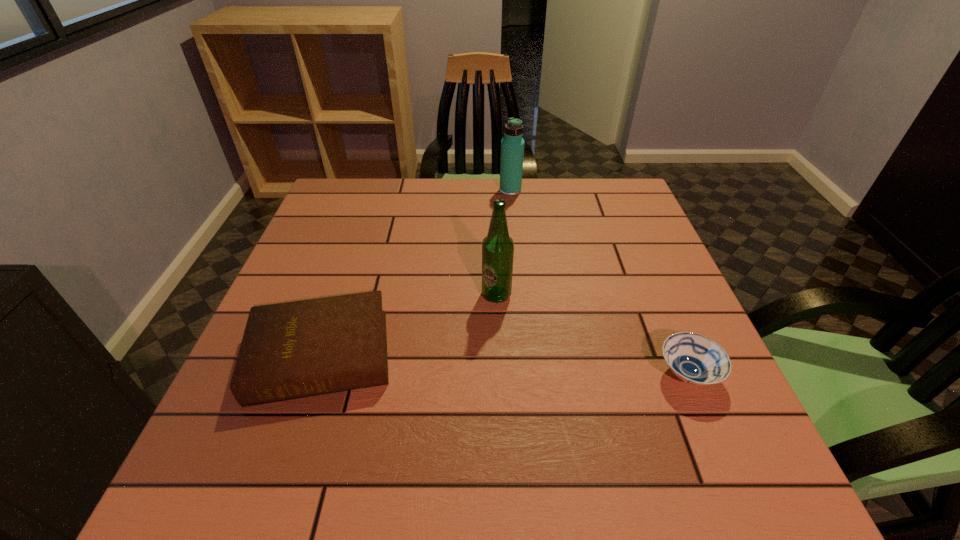
In order to click on object located at the left edge in this screenshot , I will do `click(290, 350)`.

Where is `object situated at the right edge`? The image size is (960, 540). object situated at the right edge is located at coordinates (693, 358).

What are the coordinates of `free spot at the far edge of the desktop` in the screenshot? It's located at (397, 220).

This screenshot has height=540, width=960. Find the location of `free space at the near edge of the desktop`. free space at the near edge of the desktop is located at coordinates (615, 468).

I want to click on vacant space at the left edge of the desktop, so click(297, 445).

Identify the location of vacant space at the right edge. The height and width of the screenshot is (540, 960). (666, 292).

In the image, there is a desktop. Identify the location of vacant space at the near left corner. (248, 489).

This screenshot has width=960, height=540. Find the location of `free space at the far right corner of the desktop`. free space at the far right corner of the desktop is located at coordinates (609, 210).

Locate an element on the screen. vacant space at the near right corner of the desktop is located at coordinates (708, 482).

Locate an element on the screen. The image size is (960, 540). free space between the rightmost object and the leftmost object is located at coordinates (504, 364).